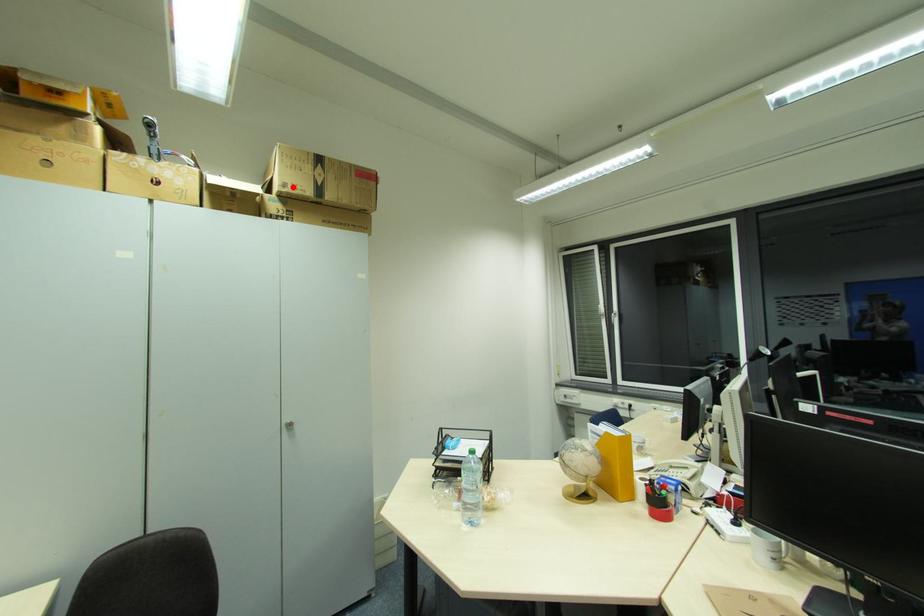
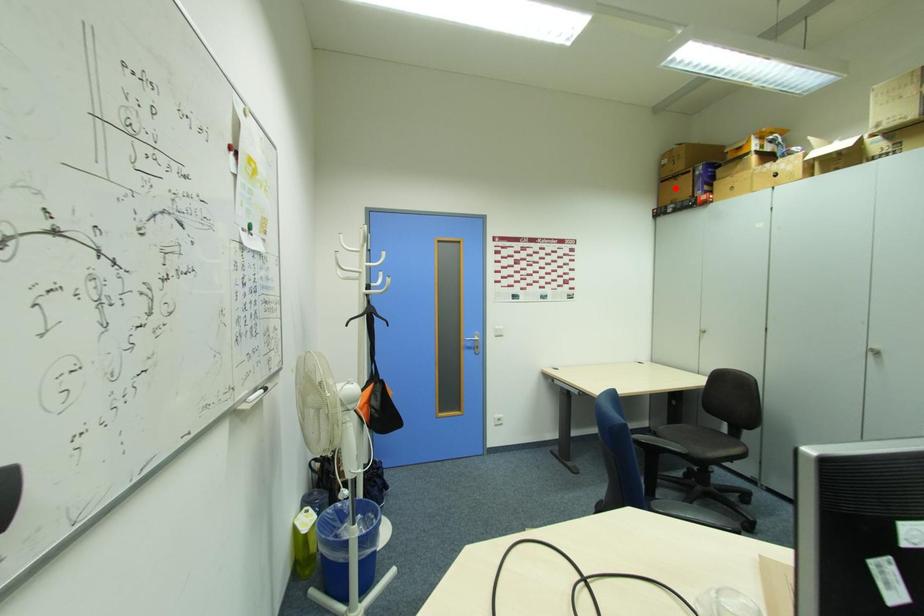
I am providing you with two images of the same scene from different viewpoints. A red point is marked on the first image and another point is marked on the second image. Does the point marked in image1 correspond to the same location as the one in image2?

No